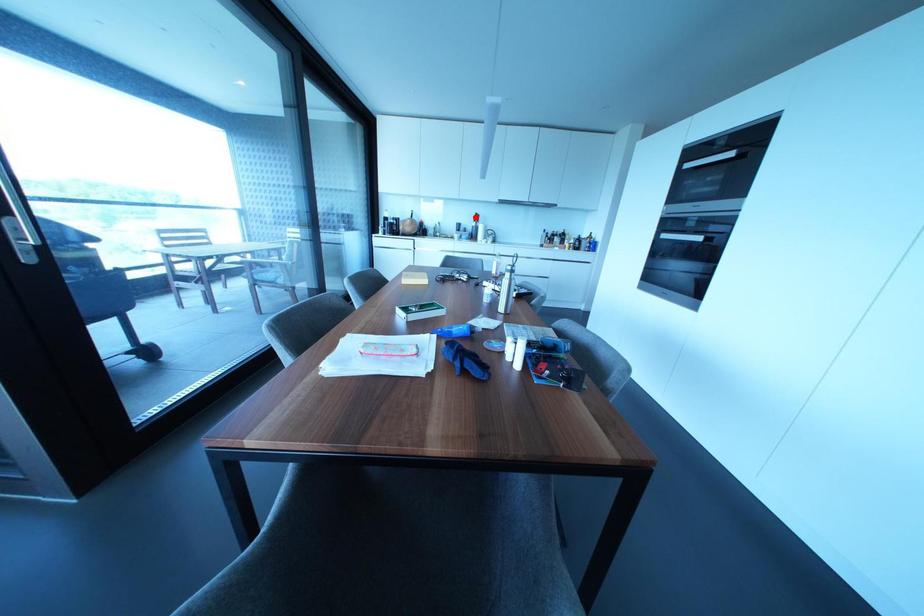
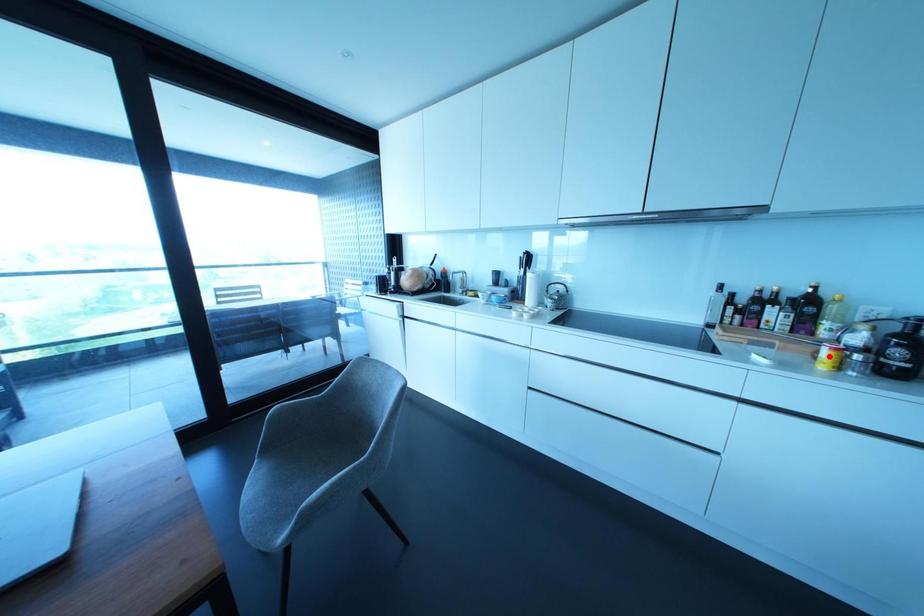
I am providing you with two images of the same scene from different viewpoints. A red point is marked on the first image and another point is marked on the second image. Do the highlighted points in image1 and image2 indicate the same real-world spot?

No